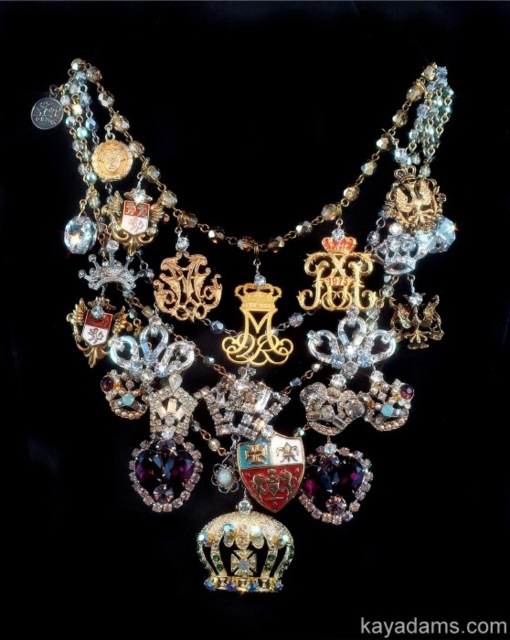
Is shiny gold crown at center smaller than goldmetalliccrown at center?

No, shiny gold crown at center is not smaller than goldmetalliccrown at center.

Who is more forward, (x=397, y=388) or (x=353, y=262)?

Point (x=397, y=388) is more forward.

You are a GUI agent. You are given a task and a screenshot of the screen. Output one action in this format:
    pyautogui.click(x=<x>, y=<y>)
    Task: Click on the shiny gold crown at center
    
    Given the screenshot: What is the action you would take?
    pyautogui.click(x=243, y=332)